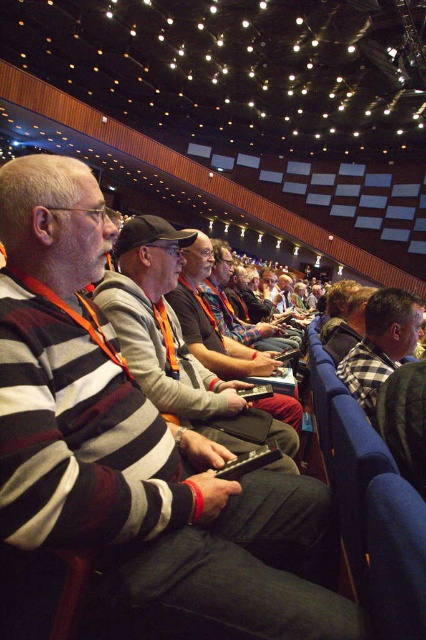
You are a photographer at a conference. You see a person wearing a striped wool sweater at center and a camera. How far apart are they?

The striped wool sweater at center and the camera are 29.02 inches apart.

You are standing at the back of the auditorium and want to walk towards the front. Which point, point (181,364) or point (213,262), will you reach first?

Point (181,364) is closer to the viewer than point (213,262), so you will reach point (181,364) first.